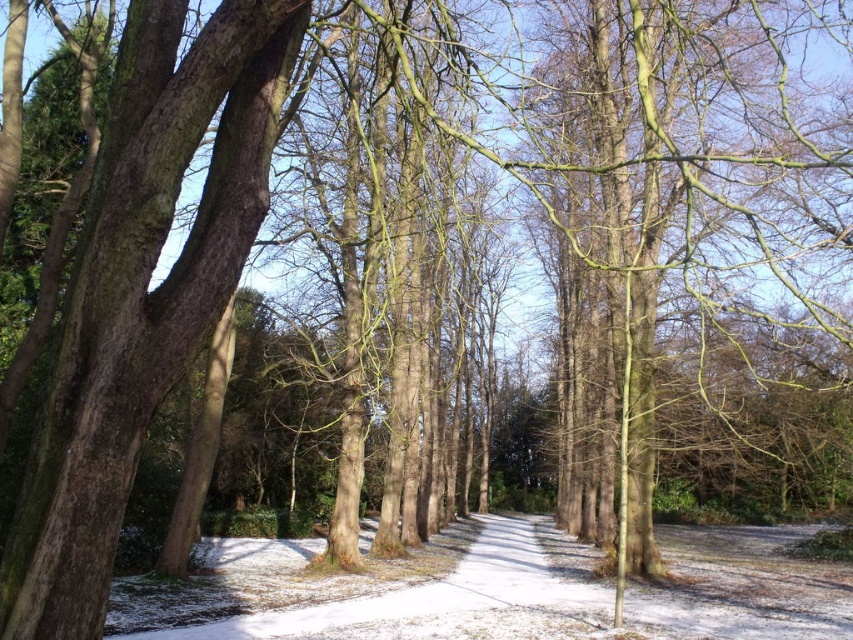
Between smooth brown tree trunk at left and white snow-covered path at center, which one is positioned lower?

white snow-covered path at center

Looking at this image, who is positioned more to the right, smooth brown tree trunk at left or white snow-covered path at center?

white snow-covered path at center is more to the right.

Who is more forward, (x=39, y=515) or (x=723, y=628)?

Positioned in front is point (x=39, y=515).

You are a GUI agent. You are given a task and a screenshot of the screen. Output one action in this format:
    pyautogui.click(x=<x>, y=<y>)
    Task: Click on the smooth brown tree trunk at left
    Image resolution: width=853 pixels, height=640 pixels.
    Given the screenshot: What is the action you would take?
    pyautogui.click(x=143, y=289)